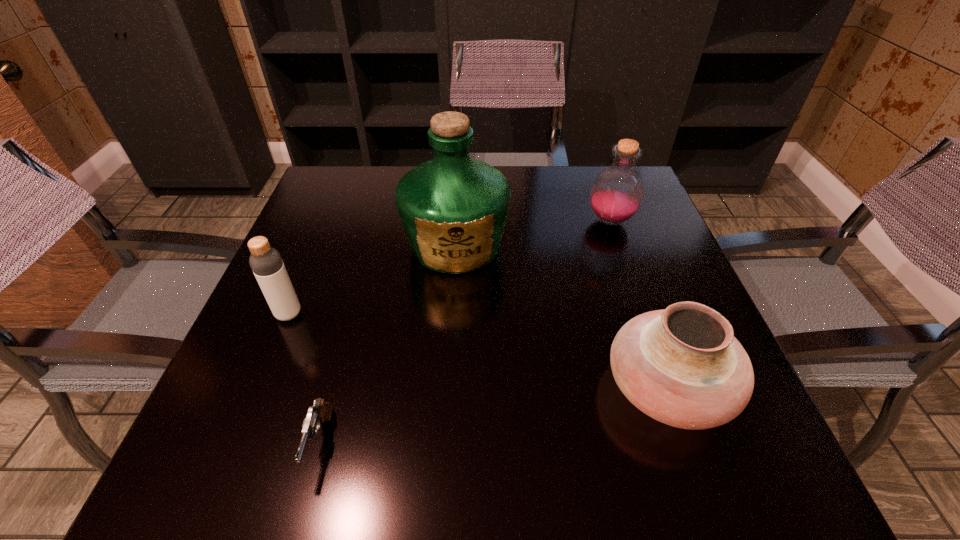
Find the location of a particular element. This screenshot has width=960, height=540. object at the near right corner is located at coordinates (682, 366).

What are the coordinates of `vacant space at the far edge of the desktop` in the screenshot? It's located at pos(387,173).

This screenshot has height=540, width=960. In the image, there is a desktop. In order to click on free space at the left edge in this screenshot , I will do `click(299, 339)`.

The width and height of the screenshot is (960, 540). In the image, there is a desktop. In order to click on vacant space at the right edge in this screenshot , I will do `click(660, 242)`.

Identify the location of free space at the far left corner. Image resolution: width=960 pixels, height=540 pixels. (367, 174).

I want to click on vacant space at the near left corner of the desktop, so click(x=188, y=452).

At what (x,y) coordinates should I click in order to perform the action: click on vacant space at the far right corner. Please return your answer as a coordinate pair (x, y). This screenshot has width=960, height=540. Looking at the image, I should click on (588, 181).

Where is `vacant region at the near right corner of the desktop`? vacant region at the near right corner of the desktop is located at coordinates (722, 483).

Locate an element on the screen. This screenshot has width=960, height=540. empty space between the pistol and the left bottle is located at coordinates (304, 378).

Where is `free space between the liquor and the farther bottle`? The height and width of the screenshot is (540, 960). free space between the liquor and the farther bottle is located at coordinates (533, 233).